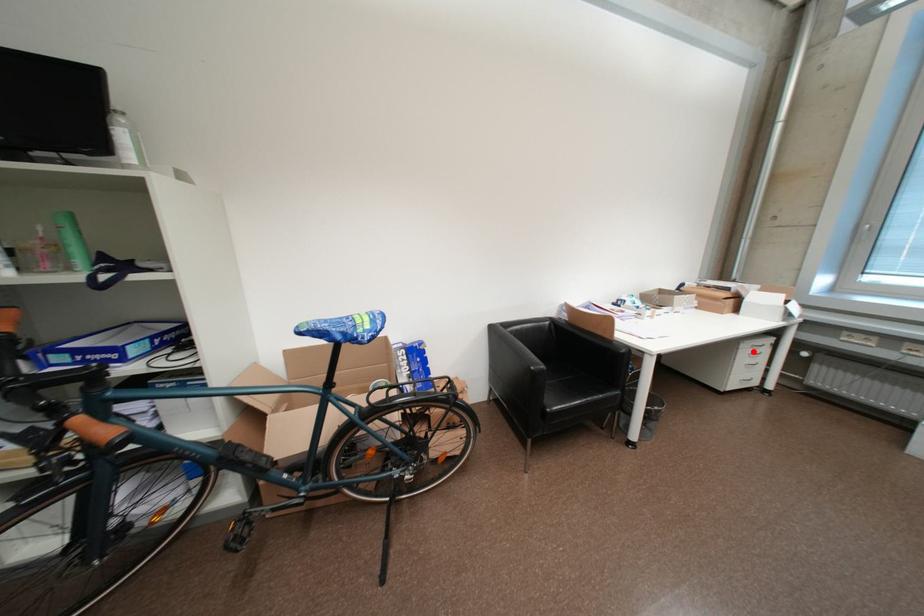
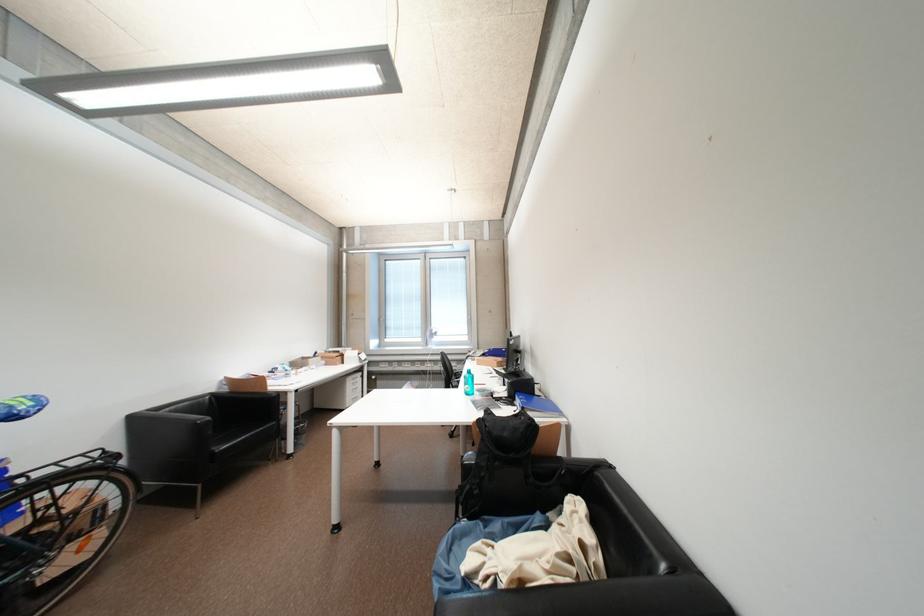
Question: A red point is marked in image1. In image2, is the corresponding 3D point closer to the camera or farther? Reply with the corresponding letter.

Choices:
 (A) The corresponding 3D point is closer.
 (B) The corresponding 3D point is farther.

Answer: (B)